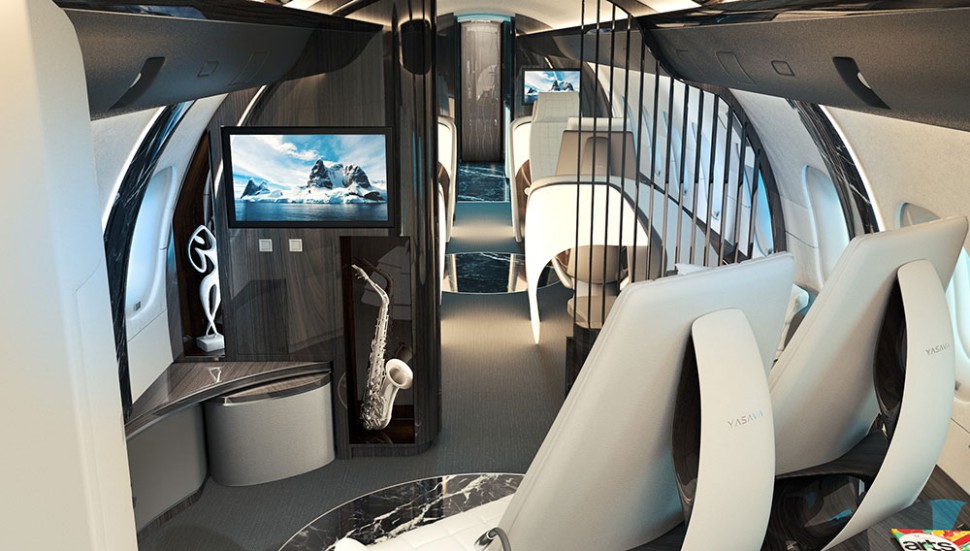
The height and width of the screenshot is (551, 970). I want to click on tvs, so click(x=340, y=161), click(x=555, y=74).